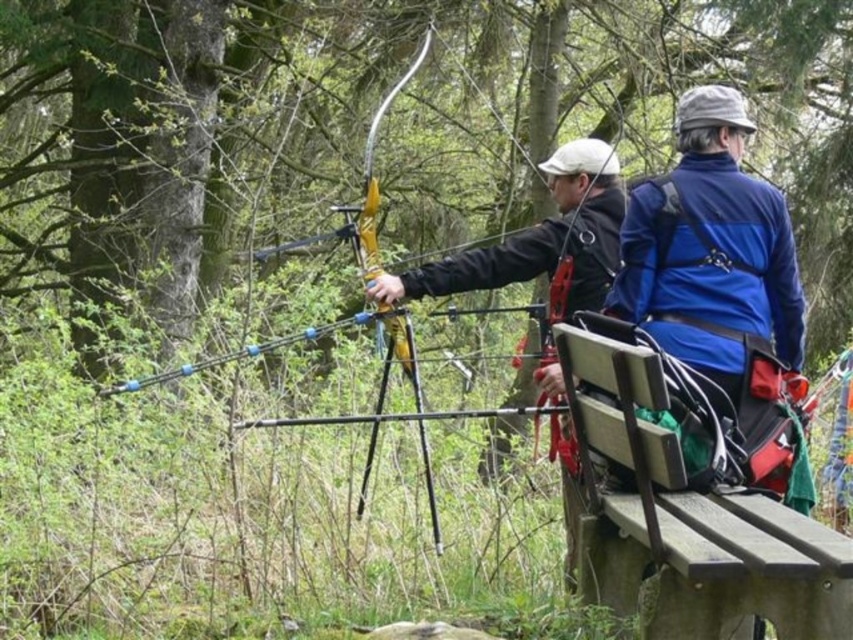
Between wooden park bench at center and matte black jacket at center, which one is positioned higher?

matte black jacket at center is above.

Is point (762, 560) closer to viewer compared to point (612, 154)?

Yes, point (762, 560) is in front of point (612, 154).

Does point (735, 532) come behind point (576, 266)?

No, it is not.

The height and width of the screenshot is (640, 853). I want to click on wooden park bench at center, so click(x=689, y=522).